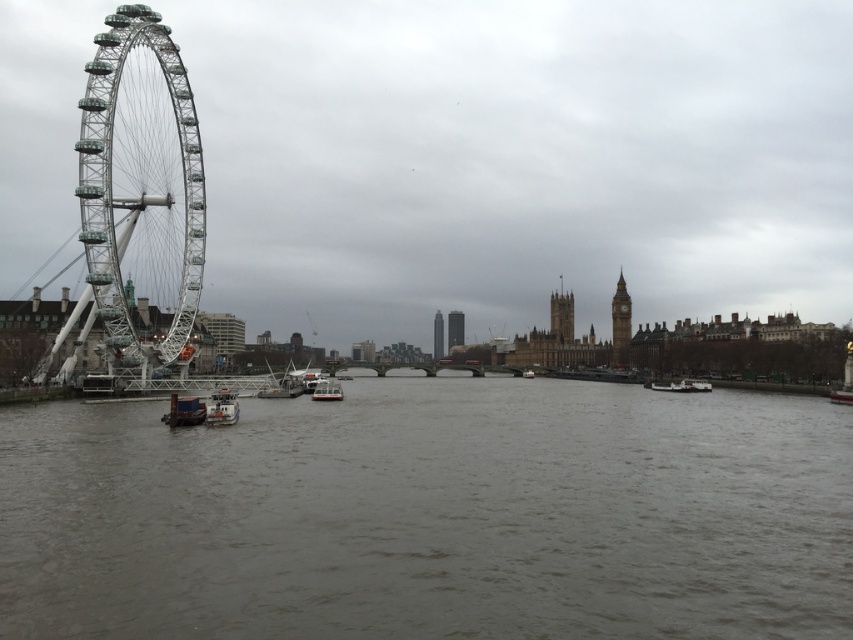
You are standing on the south bank of the River Thames, looking north towards the London Eye. You notice two points marked on the ground in front of you. The first point is at coordinates point (x=456, y=324), and the second is at point (x=436, y=360). If you were to walk directly towards the London Eye, which point would you encounter first?

Point (x=456, y=324) is in front of point (x=436, y=360), so you would encounter point (x=456, y=324) first as you walk towards the London Eye.

You are a tourist standing on the south bank of the Thames and want to take a photo of the London Eye on the left and the Houses of Parliament in the background. Where should you position yourself relative to the gray matte water at center to ensure both landmarks are in your frame?

To capture both the London Eye on the left and the Houses of Parliament in the background, you should position yourself to the left of the gray matte water at center since the London Eye is on the left side of the image and the Houses of Parliament are in the background, ensuring both are within your camera frame.